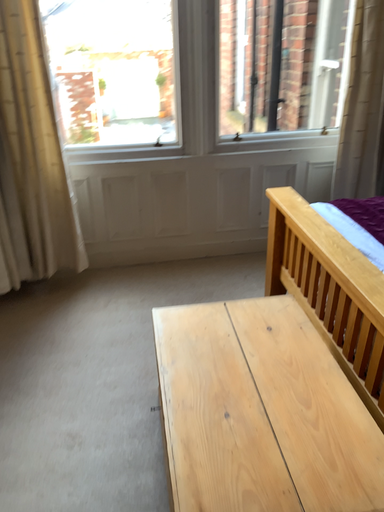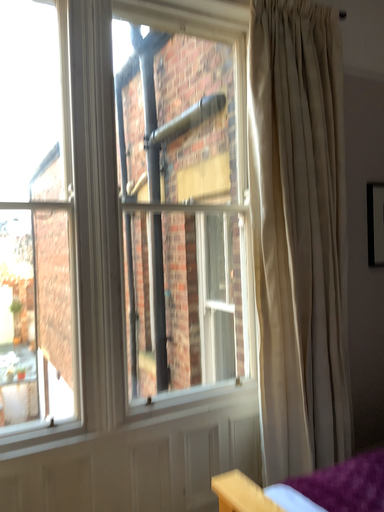
Question: How did the camera likely rotate when shooting the video?

Choices:
 (A) rotated left
 (B) rotated right

Answer: (B)